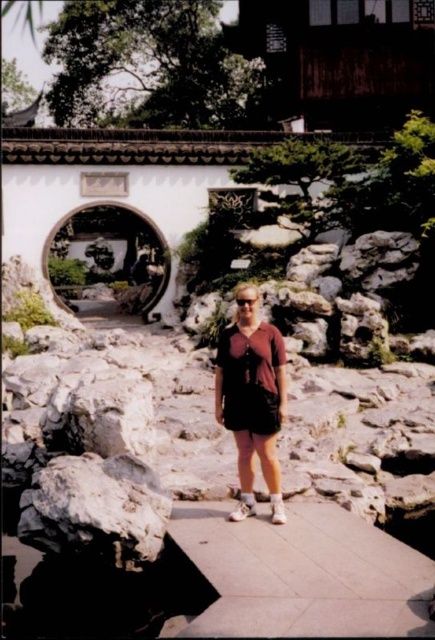
Is smooth concrete path at center positioned before dark gray rough rock at center?

That is True.

Is smooth concrete path at center positioned at the back of dark gray rough rock at center?

No, it is in front of dark gray rough rock at center.

What do you see at coordinates (303, 573) in the screenshot?
I see `smooth concrete path at center` at bounding box center [303, 573].

Locate an element on the screen. smooth concrete path at center is located at coordinates (303, 573).

Is smooth concrete path at center thinner than matte brown shorts at center?

In fact, smooth concrete path at center might be wider than matte brown shorts at center.

Does smooth concrete path at center have a smaller size compared to matte brown shorts at center?

Incorrect, smooth concrete path at center is not smaller in size than matte brown shorts at center.

Which is behind, point (421, 618) or point (227, 342)?

Point (227, 342)

Find the location of a particular element. The width and height of the screenshot is (435, 640). smooth concrete path at center is located at coordinates (303, 573).

What do you see at coordinates (96, 508) in the screenshot? Image resolution: width=435 pixels, height=640 pixels. I see `dark gray rough rock at center` at bounding box center [96, 508].

Does dark gray rough rock at center have a lesser height compared to matte brown shorts at center?

Correct, dark gray rough rock at center is not as tall as matte brown shorts at center.

The image size is (435, 640). What do you see at coordinates (96, 508) in the screenshot?
I see `dark gray rough rock at center` at bounding box center [96, 508].

Where is `dark gray rough rock at center`? The height and width of the screenshot is (640, 435). dark gray rough rock at center is located at coordinates (96, 508).